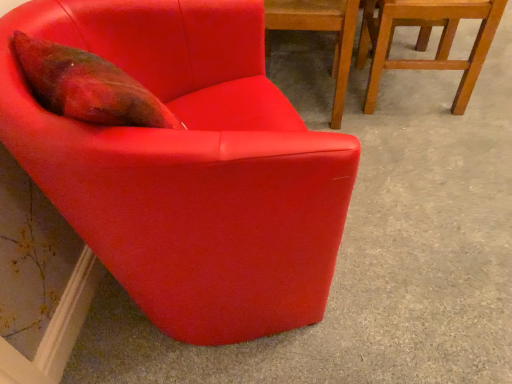
Question: Is point (357, 56) positioned closer to the camera than point (318, 19)?

Choices:
 (A) closer
 (B) farther

Answer: (B)

Question: Do you think wooden chair at upper right, which appears as the 1th chair when viewed from the right, is within matte red chair at center, the second chair positioned from the right, or outside of it?

Choices:
 (A) outside
 (B) inside

Answer: (A)

Question: Based on their relative distances, which object is nearer to the matte red armchair at upper left, which is counted as the first chair, starting from the left?

Choices:
 (A) matte red chair at center, the second chair positioned from the right
 (B) wooden chair at upper right, which appears as the 1th chair when viewed from the right

Answer: (A)

Question: Estimate the real-world distances between objects in this image. Which object is closer to the matte red chair at center, the second chair positioned from the right?

Choices:
 (A) wooden chair at upper right, which appears as the 3th chair when viewed from the left
 (B) matte red armchair at upper left, which is counted as the first chair, starting from the left

Answer: (A)